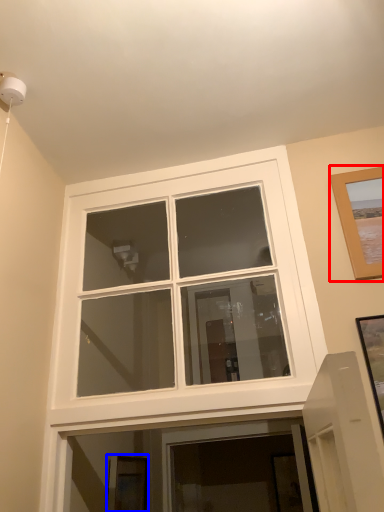
Question: Which point is further to the camera, picture frame (highlighted by a red box) or picture frame (highlighted by a blue box)?

Choices:
 (A) picture frame
 (B) picture frame

Answer: (B)